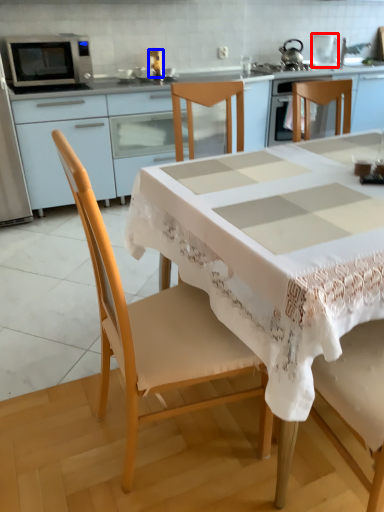
Question: Which object is closer to the camera taking this photo, appliance (highlighted by a red box) or appliance (highlighted by a blue box)?

Choices:
 (A) appliance
 (B) appliance

Answer: (B)